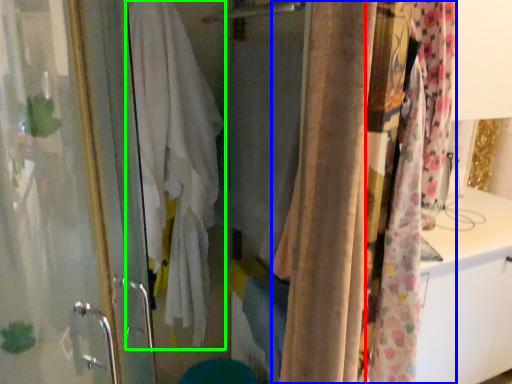
Question: Estimate the real-world distances between objects in this image. Which object is farther from curtain (highlighted by a red box), curtain (highlighted by a blue box) or bath towel (highlighted by a green box)?

Choices:
 (A) curtain
 (B) bath towel

Answer: (B)